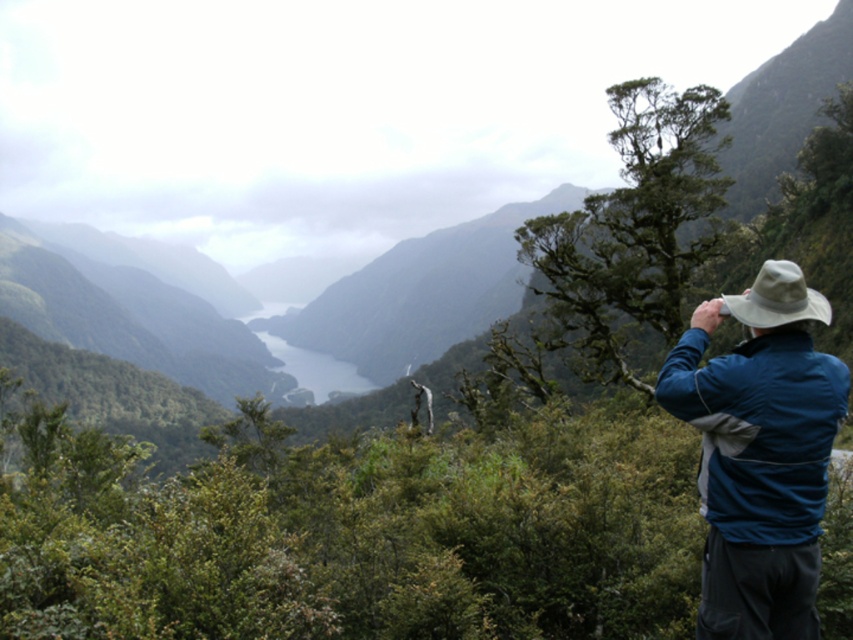
You are a hiker who has just reached the top of a mountain and is looking at the valley below. You see the green leafy shrubs at center and the beige fabric hat at upper right in the distance. Which object is closer to the edge of the cliff you just climbed?

The beige fabric hat at upper right is closer to the edge of the cliff because it is positioned to the right of the green leafy shrubs at center, which are further away in the center of the scene.